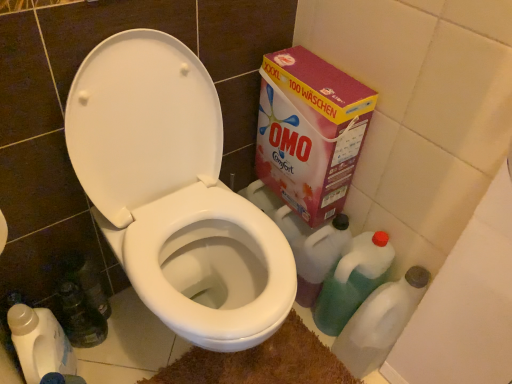
Image resolution: width=512 pixels, height=384 pixels. Describe the element at coordinates (174, 193) in the screenshot. I see `white glossy toilet at center` at that location.

The image size is (512, 384). Describe the element at coordinates (40, 343) in the screenshot. I see `white plastic bottle at lower left, marked as the first cleaning product in a left-to-right arrangement` at that location.

The height and width of the screenshot is (384, 512). Describe the element at coordinates (380, 322) in the screenshot. I see `translucent plastic bottle at lower right` at that location.

Image resolution: width=512 pixels, height=384 pixels. Describe the element at coordinates (261, 362) in the screenshot. I see `brown shaggy bath mat at lower center` at that location.

I want to click on white glossy toilet at center, so click(x=174, y=193).

From a real-world perspective, who is located lower, translucent plastic bottle at lower right, which is the 2th cleaning product from left to right, or white glossy toilet at center?

translucent plastic bottle at lower right, which is the 2th cleaning product from left to right, from a real-world perspective.

Is translucent plastic bottle at lower right, which is the 2th cleaning product from left to right, positioned beyond the bounds of white glossy toilet at center?

That's correct, translucent plastic bottle at lower right, which is the 2th cleaning product from left to right, is outside of white glossy toilet at center.

Is white glossy toilet at center at the back of translucent plastic bottle at lower right, which is the 2th cleaning product from left to right?

That's not correct — translucent plastic bottle at lower right, which is the 2th cleaning product from left to right, is not looking away from white glossy toilet at center.

Which point is more forward, (376, 237) or (120, 157)?

The point (120, 157) is more forward.

Considering the positions of point (337, 206) and point (32, 314), is point (337, 206) closer or farther from the camera than point (32, 314)?

Clearly, point (337, 206) is more distant from the camera than point (32, 314).

From the image's perspective, is pink cardboard box at upper right under white plastic bottle at lower left, which is counted as the second cleaning product, starting from the right?

No.

Which of these two, pink cardboard box at upper right or white plastic bottle at lower left, marked as the first cleaning product in a left-to-right arrangement, is wider?

Wider between the two is pink cardboard box at upper right.

Are pink cardboard box at upper right and white plastic bottle at lower left, marked as the first cleaning product in a left-to-right arrangement, beside each other?

pink cardboard box at upper right is not next to white plastic bottle at lower left, marked as the first cleaning product in a left-to-right arrangement, and they're not touching.

Which of these two, white plastic bottle at lower left, which is counted as the second cleaning product, starting from the right, or white glossy toilet at center, stands taller?

white glossy toilet at center.

From the image's perspective, is white plastic bottle at lower left, marked as the first cleaning product in a left-to-right arrangement, above white glossy toilet at center?

Actually, white plastic bottle at lower left, marked as the first cleaning product in a left-to-right arrangement, appears below white glossy toilet at center in the image.

From a real-world perspective, does white plastic bottle at lower left, marked as the first cleaning product in a left-to-right arrangement, sit lower than white glossy toilet at center?

Yes.

How different are the orientations of white plastic bottle at lower left, marked as the first cleaning product in a left-to-right arrangement, and white glossy toilet at center in degrees?

The angular difference between white plastic bottle at lower left, marked as the first cleaning product in a left-to-right arrangement, and white glossy toilet at center is 88 degrees.

Is point (63, 364) closer or farther from the camera than point (291, 53)?

Clearly, point (63, 364) is closer to the camera than point (291, 53).

Is the position of white plastic bottle at lower left, marked as the first cleaning product in a left-to-right arrangement, more distant than that of pink cardboard box at upper right?

No, it is not.

From the image's perspective, is white plastic bottle at lower left, which is counted as the second cleaning product, starting from the right, located above or below pink cardboard box at upper right?

white plastic bottle at lower left, which is counted as the second cleaning product, starting from the right, is situated lower than pink cardboard box at upper right in the image.

From the picture: Considering the positions of objects white plastic bottle at lower left, which is counted as the second cleaning product, starting from the right, and pink cardboard box at upper right in the image provided, who is more to the left, white plastic bottle at lower left, which is counted as the second cleaning product, starting from the right, or pink cardboard box at upper right?

Positioned to the left is white plastic bottle at lower left, which is counted as the second cleaning product, starting from the right.

Between brown shaggy bath mat at lower center and translucent plastic bottle at lower right, which is the 2th cleaning product from left to right, which one has less height?

Standing shorter between the two is brown shaggy bath mat at lower center.

Would you say brown shaggy bath mat at lower center contains translucent plastic bottle at lower right, which is the first cleaning product from right to left?

That's incorrect, translucent plastic bottle at lower right, which is the first cleaning product from right to left, is not inside brown shaggy bath mat at lower center.

How much distance is there between brown shaggy bath mat at lower center and translucent plastic bottle at lower right, which is the 2th cleaning product from left to right?

9.00 inches.

Is brown shaggy bath mat at lower center far from translucent plastic bottle at lower right, which is the 2th cleaning product from left to right?

That's not correct — brown shaggy bath mat at lower center is a little close to translucent plastic bottle at lower right, which is the 2th cleaning product from left to right.

Is brown shaggy bath mat at lower center placed right next to pink cardboard box at upper right?

No, brown shaggy bath mat at lower center is not touching pink cardboard box at upper right.

From the image's perspective, is brown shaggy bath mat at lower center below pink cardboard box at upper right?

Correct, brown shaggy bath mat at lower center appears lower than pink cardboard box at upper right in the image.

Is brown shaggy bath mat at lower center positioned with its back to pink cardboard box at upper right?

No, brown shaggy bath mat at lower center is not facing the opposite direction of pink cardboard box at upper right.

Considering the positions of objects brown shaggy bath mat at lower center and pink cardboard box at upper right in the image provided, who is more to the right, brown shaggy bath mat at lower center or pink cardboard box at upper right?

pink cardboard box at upper right.

Is pink cardboard box at upper right at the back of translucent plastic bottle at lower right?

No, translucent plastic bottle at lower right is not facing away from pink cardboard box at upper right.

Considering the sizes of translucent plastic bottle at lower right and pink cardboard box at upper right in the image, is translucent plastic bottle at lower right bigger or smaller than pink cardboard box at upper right?

In the image, translucent plastic bottle at lower right appears to be smaller than pink cardboard box at upper right.

Is translucent plastic bottle at lower right with pink cardboard box at upper right?

No, translucent plastic bottle at lower right is not touching pink cardboard box at upper right.

How far apart are translucent plastic bottle at lower right and pink cardboard box at upper right?

A distance of 16.25 inches exists between translucent plastic bottle at lower right and pink cardboard box at upper right.

The image size is (512, 384). Identify the location of toilet that is in front of the translucent plastic bottle at lower right, which is the first cleaning product from right to left. (174, 193).

Locate an element on the screen. The image size is (512, 384). cardboard box above the white plastic bottle at lower left, which is counted as the second cleaning product, starting from the right (from a real-world perspective) is located at coordinates (310, 131).

Considering their positions, is translucent plastic bottle at lower right, which is the first cleaning product from right to left, positioned closer to white glossy toilet at center than translucent plastic bottle at lower right?

translucent plastic bottle at lower right, which is the first cleaning product from right to left, lies closer to white glossy toilet at center than the other object.

When comparing their distances from white plastic bottle at lower left, which is counted as the second cleaning product, starting from the right, does translucent plastic bottle at lower right or pink cardboard box at upper right seem further?

translucent plastic bottle at lower right lies further to white plastic bottle at lower left, which is counted as the second cleaning product, starting from the right, than the other object.

In the scene shown: Looking at the image, which one is located further to brown shaggy bath mat at lower center, translucent plastic bottle at lower right or white plastic bottle at lower left, which is counted as the second cleaning product, starting from the right?

white plastic bottle at lower left, which is counted as the second cleaning product, starting from the right, is further to brown shaggy bath mat at lower center.

Based on their spatial positions, is white plastic bottle at lower left, marked as the first cleaning product in a left-to-right arrangement, or brown shaggy bath mat at lower center further from translucent plastic bottle at lower right?

Based on the image, white plastic bottle at lower left, marked as the first cleaning product in a left-to-right arrangement, appears to be further to translucent plastic bottle at lower right.

From the picture: Based on their spatial positions, is translucent plastic bottle at lower right, which is the first cleaning product from right to left, or white glossy toilet at center further from brown shaggy bath mat at lower center?

Based on the image, white glossy toilet at center appears to be further to brown shaggy bath mat at lower center.

Based on their spatial positions, is translucent plastic bottle at lower right or white glossy toilet at center further from white plastic bottle at lower left, which is counted as the second cleaning product, starting from the right?

The object further to white plastic bottle at lower left, which is counted as the second cleaning product, starting from the right, is translucent plastic bottle at lower right.

Estimate the real-world distances between objects in this image. Which object is further from translucent plastic bottle at lower right, white glossy toilet at center or pink cardboard box at upper right?

The object further to translucent plastic bottle at lower right is white glossy toilet at center.

Considering their positions, is brown shaggy bath mat at lower center positioned further to translucent plastic bottle at lower right, which is the 2th cleaning product from left to right, than white plastic bottle at lower left, marked as the first cleaning product in a left-to-right arrangement?

white plastic bottle at lower left, marked as the first cleaning product in a left-to-right arrangement, lies further to translucent plastic bottle at lower right, which is the 2th cleaning product from left to right, than the other object.

Locate an element on the screen. This screenshot has height=384, width=512. cardboard box located between white glossy toilet at center and translucent plastic bottle at lower right, which is the first cleaning product from right to left, in the depth direction is located at coordinates (310, 131).

Find the location of a particular element. cardboard box between white glossy toilet at center and translucent plastic bottle at lower right from front to back is located at coordinates (310, 131).

The image size is (512, 384). In order to click on bottle that lies between pink cardboard box at upper right and brown shaggy bath mat at lower center from top to bottom in this screenshot , I will do `click(380, 322)`.

Locate an element on the screen. bath mat between white plastic bottle at lower left, marked as the first cleaning product in a left-to-right arrangement, and translucent plastic bottle at lower right from left to right is located at coordinates (261, 362).